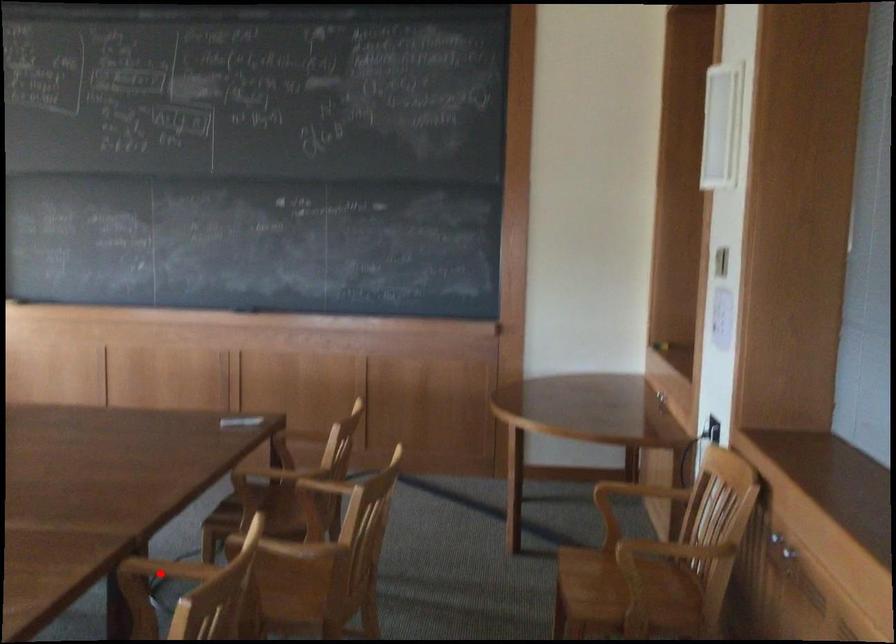
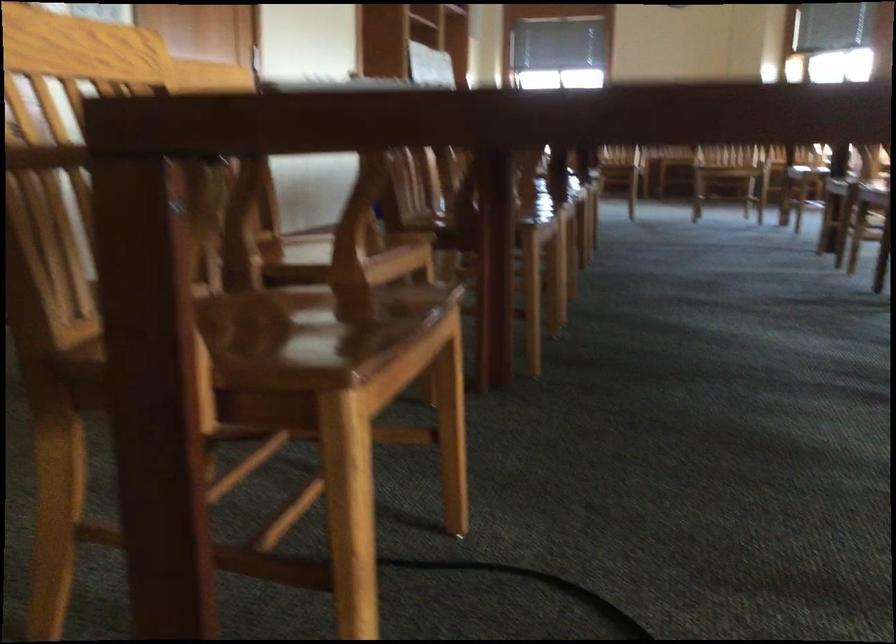
Question: I am providing you with two images of the same scene from different viewpoints. A red point is marked on the first image. At the location where the point appears in image 1, is it still visible in image 2?

Choices:
 (A) Yes
 (B) No

Answer: (B)